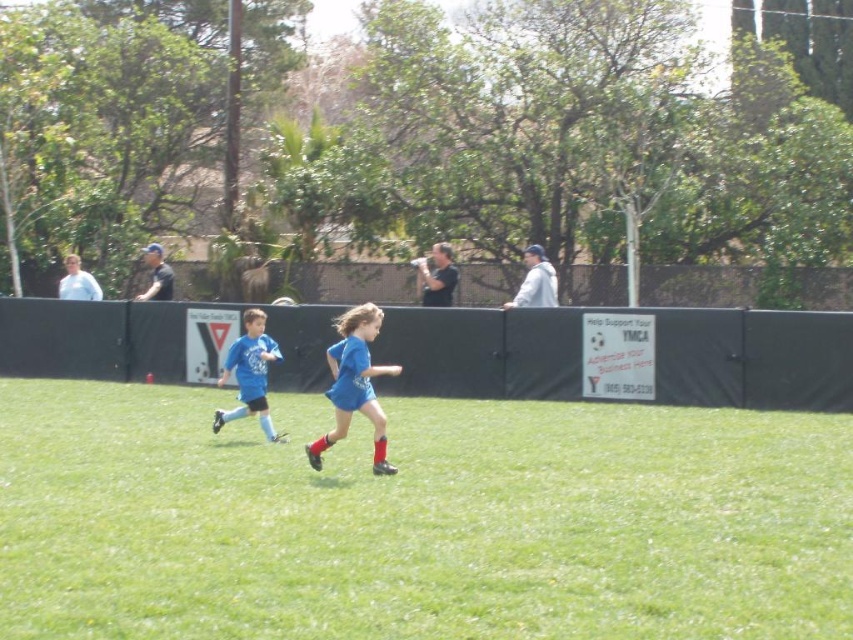
Question: Which of the following is the farthest from the observer?

Choices:
 (A) [x=544, y=417]
 (B) [x=370, y=308]
 (C) [x=258, y=416]

Answer: (A)

Question: Can you confirm if green grass at center is smaller than blue jersey at center?

Choices:
 (A) yes
 (B) no

Answer: (B)

Question: Can you confirm if green grass at center is positioned above blue matte soccer jersey at center?

Choices:
 (A) no
 (B) yes

Answer: (A)

Question: Which object is closer to the camera taking this photo?

Choices:
 (A) blue jersey at center
 (B) green grass at center

Answer: (B)

Question: Is blue matte soccer jersey at center thinner than blue jersey at center?

Choices:
 (A) no
 (B) yes

Answer: (B)

Question: Which point is farther to the camera?

Choices:
 (A) (579, 454)
 (B) (218, 429)

Answer: (B)